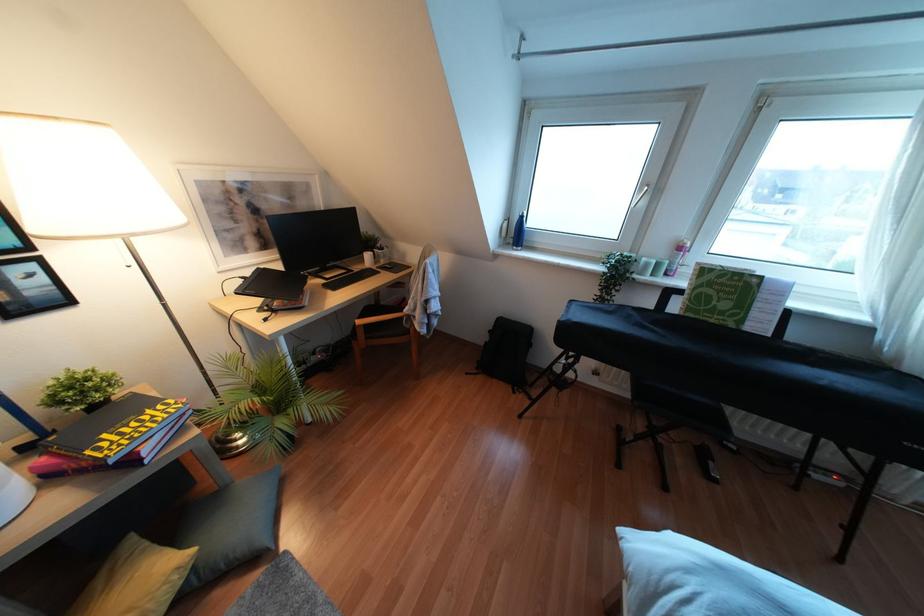
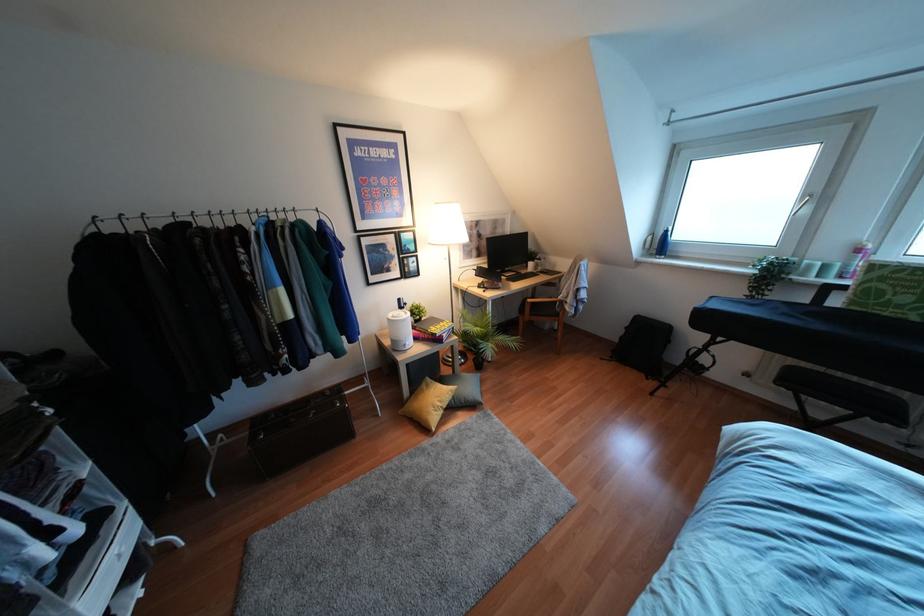
Where in the second image is the point corresponding to (657,265) from the first image?

(824, 267)